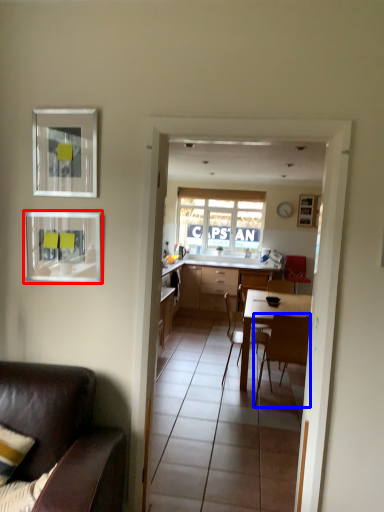
Question: Which object appears closest to the camera in this image, picture frame (highlighted by a red box) or chair (highlighted by a blue box)?

Choices:
 (A) picture frame
 (B) chair

Answer: (A)